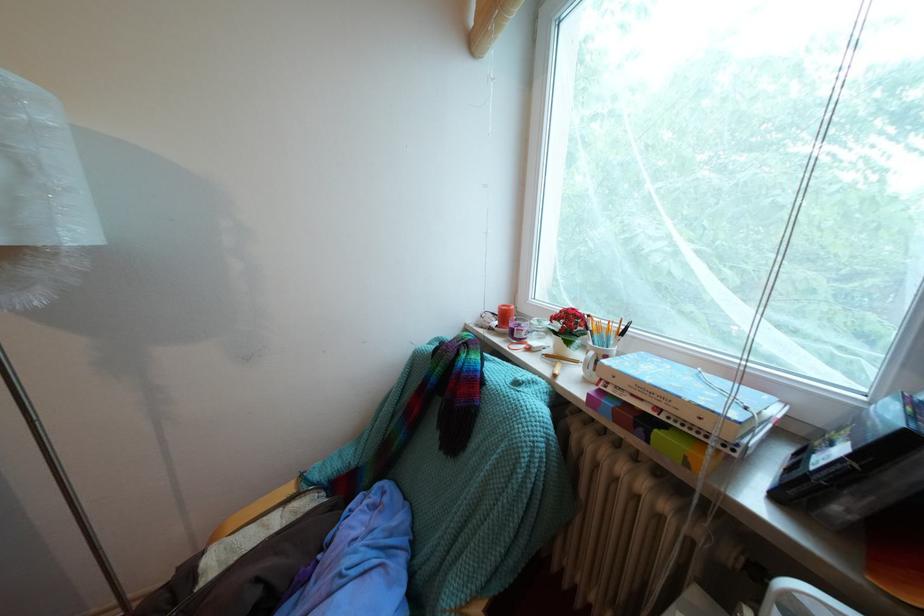
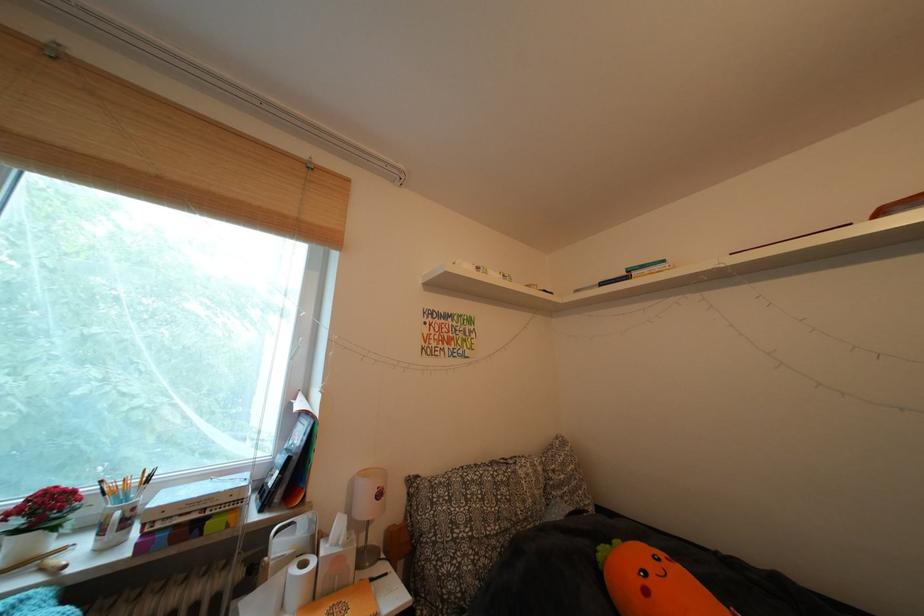
Locate, in the second image, the point that corresponds to (x=602, y=359) in the first image.

(128, 519)